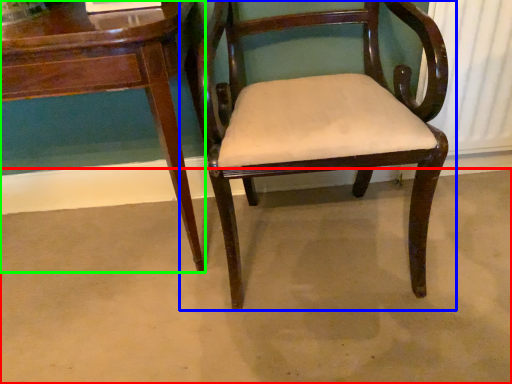
Question: Which object is positioned closest to concrete (highlighted by a red box)? Select from chair (highlighted by a blue box) and table (highlighted by a green box).

Choices:
 (A) chair
 (B) table

Answer: (A)